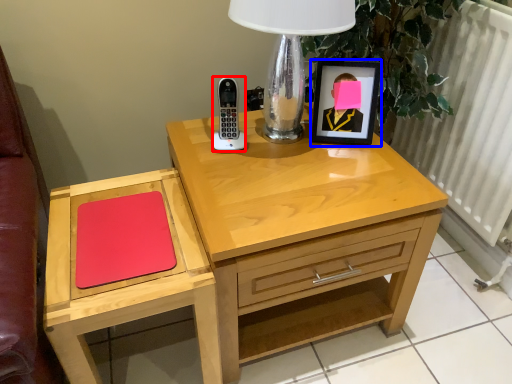
Question: Which object is further to the camera taking this photo, control (highlighted by a red box) or picture frame (highlighted by a blue box)?

Choices:
 (A) control
 (B) picture frame

Answer: (B)